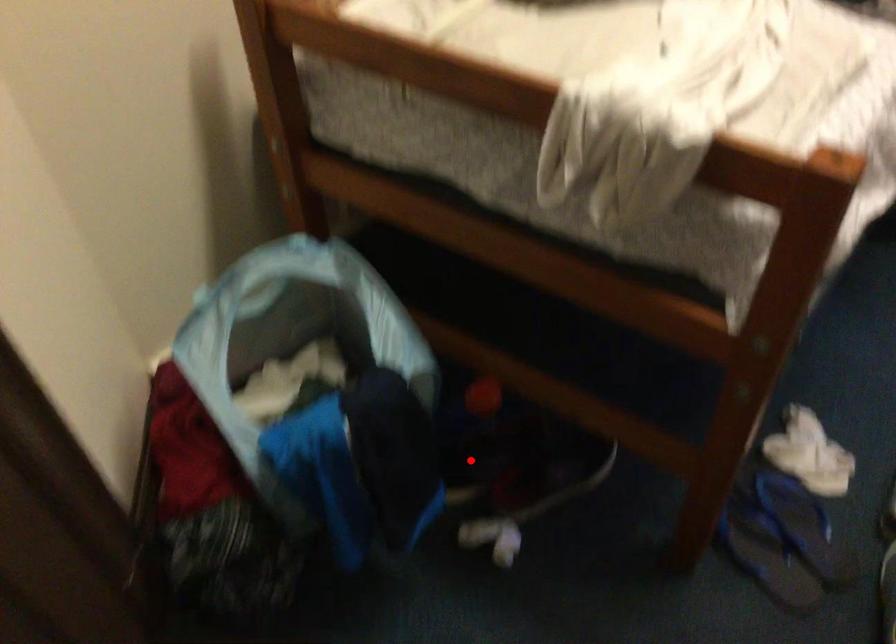
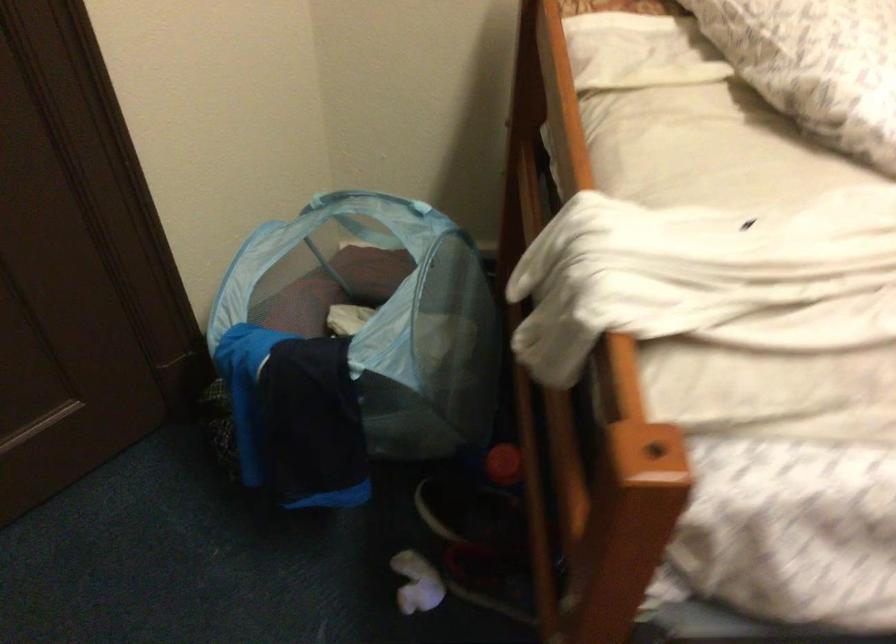
In the second image, find the point that corresponds to the highlighted location in the first image.

(469, 509)